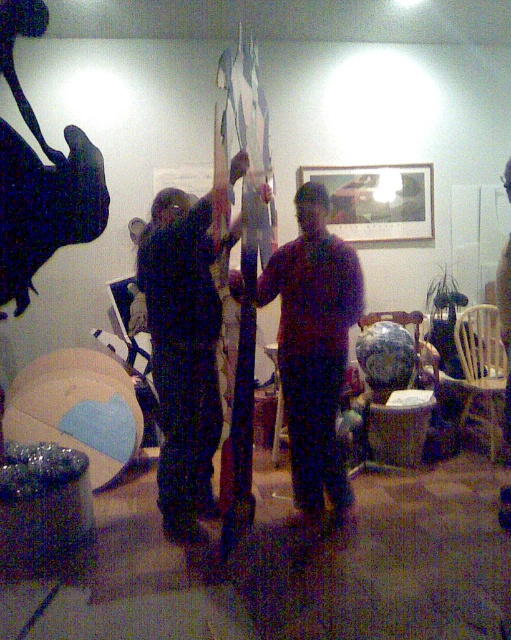
Question: Can you confirm if black fabric pants at center is positioned to the left of matte dark brown shirt at center?

Choices:
 (A) yes
 (B) no

Answer: (A)

Question: Which point is farther to the camera?

Choices:
 (A) (304, 371)
 (B) (192, 360)

Answer: (A)

Question: Is black fabric pants at center to the right of matte dark brown shirt at center from the viewer's perspective?

Choices:
 (A) no
 (B) yes

Answer: (A)

Question: Which object is closer to the camera taking this photo?

Choices:
 (A) matte dark brown shirt at center
 (B) black fabric pants at center

Answer: (B)

Question: Where is black fabric pants at center located in relation to matte dark brown shirt at center in the image?

Choices:
 (A) above
 (B) below

Answer: (A)